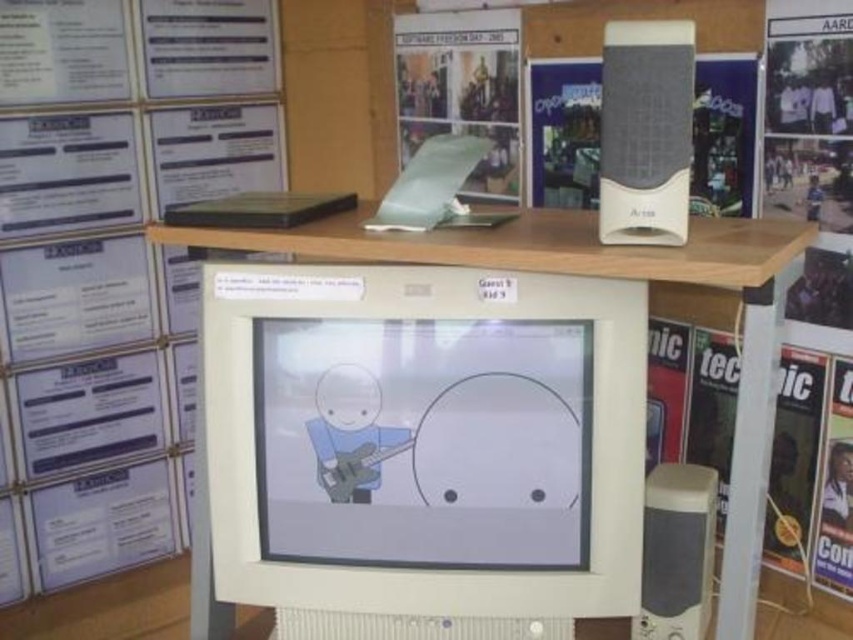
Question: Which object is the farthest from the white paper at upper left?

Choices:
 (A) white plastic computer desk at center
 (B) white plastic speaker at upper right

Answer: (B)

Question: Among these objects, which one is farthest from the camera?

Choices:
 (A) white plastic computer desk at center
 (B) white plastic speaker at lower right
 (C) white plastic speaker at upper right

Answer: (B)

Question: Which object appears farthest from the camera in this image?

Choices:
 (A) white plastic speaker at lower right
 (B) white plastic computer desk at center
 (C) white plastic speaker at upper right

Answer: (A)

Question: Does white paper at upper left appear on the right side of white plastic computer desk at center?

Choices:
 (A) yes
 (B) no

Answer: (B)

Question: Can you confirm if white paper at upper left is positioned to the right of white plastic speaker at lower right?

Choices:
 (A) no
 (B) yes

Answer: (A)

Question: Does white plastic speaker at upper right have a lesser width compared to white plastic speaker at lower right?

Choices:
 (A) no
 (B) yes

Answer: (B)